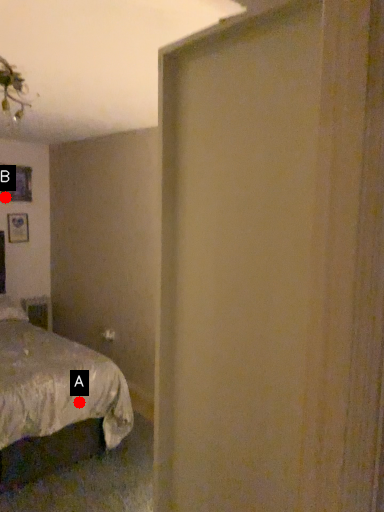
Question: Two points are circled on the image, labeled by A and B beside each circle. Which point appears closest to the camera in this image?

Choices:
 (A) A is closer
 (B) B is closer

Answer: (A)